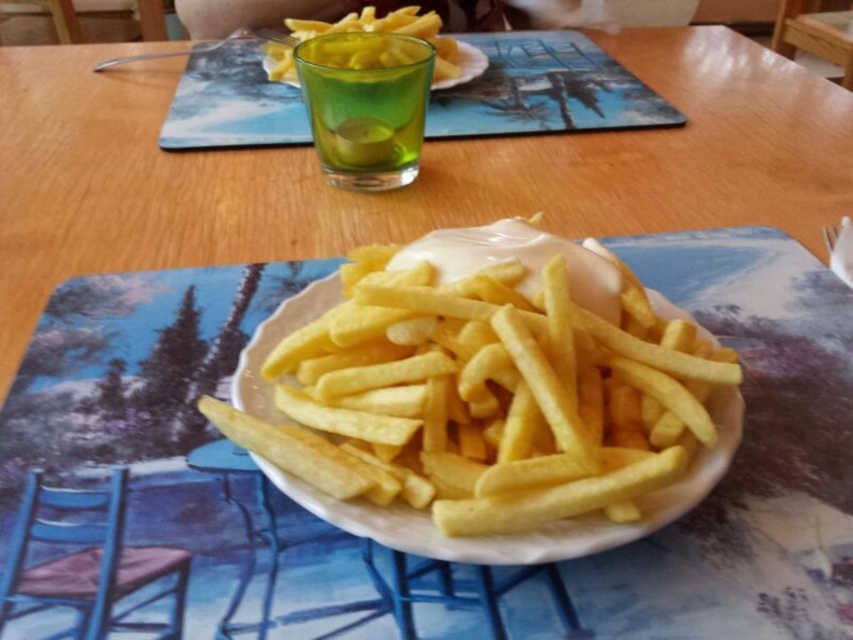
Question: Which object is farther from the camera taking this photo?

Choices:
 (A) golden crispy french fries at center
 (B) yellow crispy french fries at upper center

Answer: (B)

Question: Observing the image, what is the correct spatial positioning of golden crispy french fries at center in reference to yellow crispy french fries at upper center?

Choices:
 (A) above
 (B) below

Answer: (B)

Question: Which of the following is the farthest from the observer?

Choices:
 (A) (378, 22)
 (B) (440, 444)

Answer: (A)

Question: Is golden crispy french fries at center behind yellow crispy french fries at upper center?

Choices:
 (A) yes
 (B) no

Answer: (B)

Question: Can you confirm if golden crispy french fries at center is positioned below yellow crispy french fries at upper center?

Choices:
 (A) no
 (B) yes

Answer: (B)